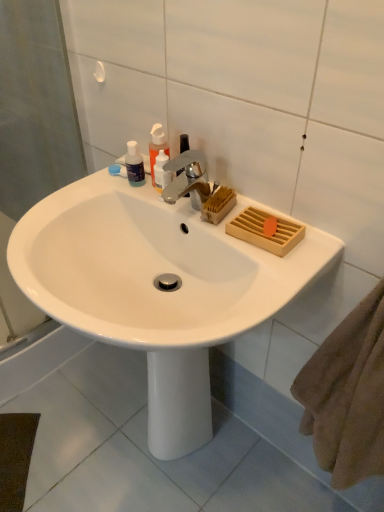
Where is `vacant space in white glossy sink at center (from a real-world perspective)`? This screenshot has width=384, height=512. vacant space in white glossy sink at center (from a real-world perspective) is located at coordinates (155, 454).